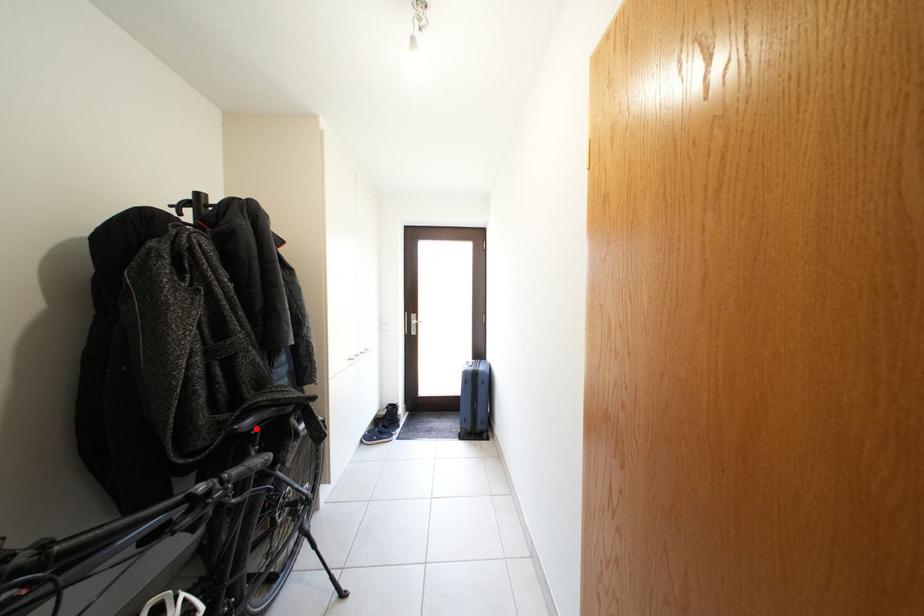
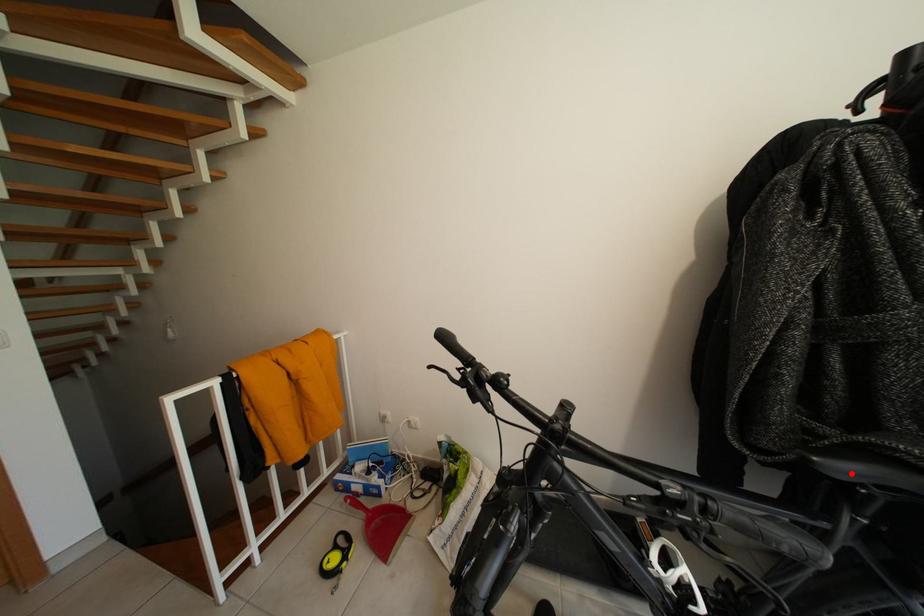
I am providing you with two images of the same scene from different viewpoints. A red point is marked on the first image and another point is marked on the second image. Is the red point in image1 aligned with the point shown in image2?

Yes